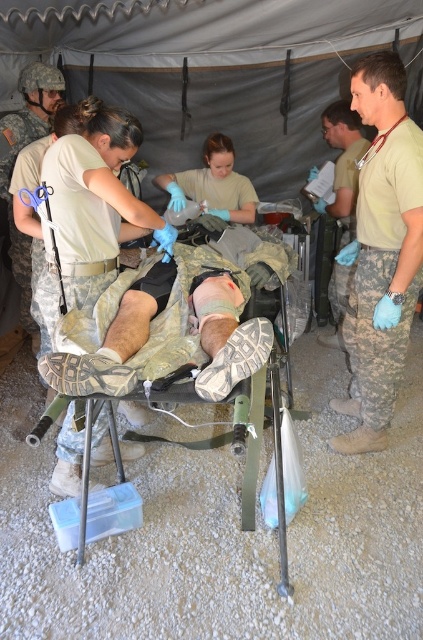
Question: Is camouflage uniform at right wider than matte blue gloves at center?

Choices:
 (A) no
 (B) yes

Answer: (A)

Question: Does tan uniform at right have a smaller size compared to matte blue gloves at center?

Choices:
 (A) no
 (B) yes

Answer: (B)

Question: Which object is farther from the camera taking this photo?

Choices:
 (A) camouflage uniform at right
 (B) camouflage fabric stretcher at center
 (C) camouflage fabric uniform at center

Answer: (A)

Question: Among these points, which one is farthest from the camera?

Choices:
 (A) (354, 109)
 (B) (129, 317)
 (C) (208, 294)
 (D) (409, 168)

Answer: (A)

Question: Which point is farther from the camera taking this photo?

Choices:
 (A) (370, 403)
 (B) (334, 304)
 (C) (233, 323)

Answer: (B)

Question: Can you confirm if camouflage uniform at right is smaller than camouflage fabric uniform at center?

Choices:
 (A) yes
 (B) no

Answer: (A)